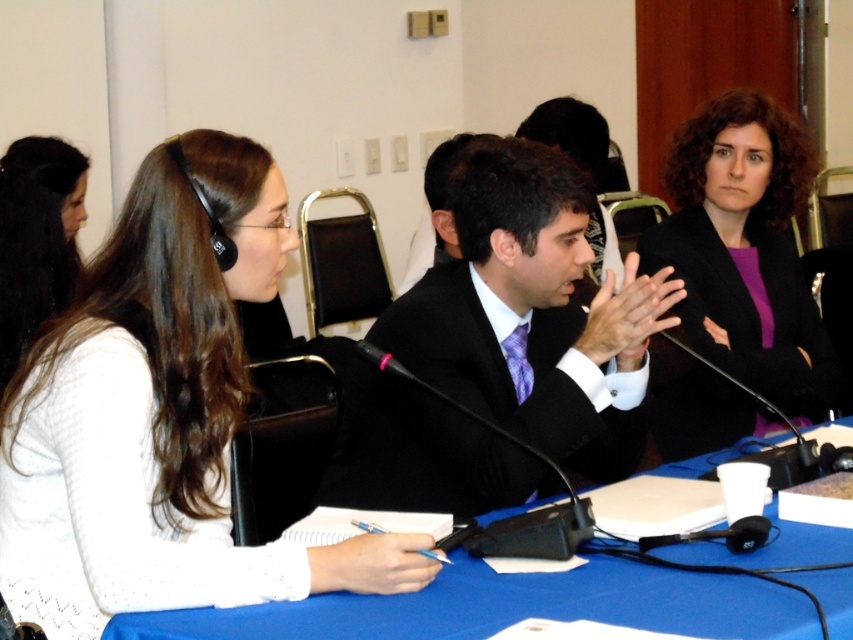
Can you confirm if purple matte blazer at upper right is thinner than smooth white shirt at left?

In fact, purple matte blazer at upper right might be wider than smooth white shirt at left.

Is purple matte blazer at upper right positioned behind smooth white shirt at left?

No, it is in front of smooth white shirt at left.

Which is behind, point (747, 412) or point (68, 268)?

Point (68, 268)

Where is `purple matte blazer at upper right`? The height and width of the screenshot is (640, 853). purple matte blazer at upper right is located at coordinates (746, 250).

Who is taller, white matte sweater at left or smooth white shirt at left?

white matte sweater at left is taller.

Is white matte sweater at left wider than smooth white shirt at left?

Indeed, white matte sweater at left has a greater width compared to smooth white shirt at left.

Measure the distance between point [260,212] and camera.

Point [260,212] and camera are 5.29 feet apart.

Identify the location of white matte sweater at left. (160, 416).

In the scene shown: Is the position of white matte sweater at left less distant than that of blue fabric table at center?

No, white matte sweater at left is behind blue fabric table at center.

Describe the element at coordinates (160, 416) in the screenshot. I see `white matte sweater at left` at that location.

The image size is (853, 640). What are the coordinates of `white matte sweater at left` in the screenshot? It's located at (160, 416).